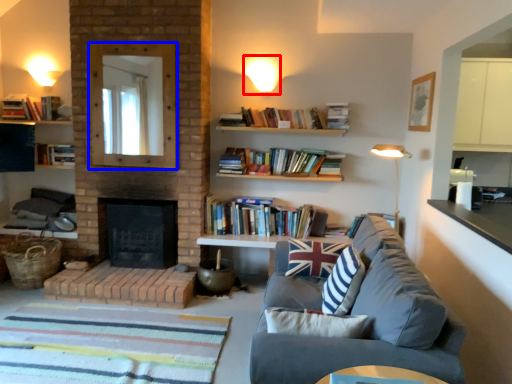
Question: Which object appears farthest to the camera in this image, lighting (highlighted by a red box) or mirror (highlighted by a blue box)?

Choices:
 (A) lighting
 (B) mirror

Answer: (A)